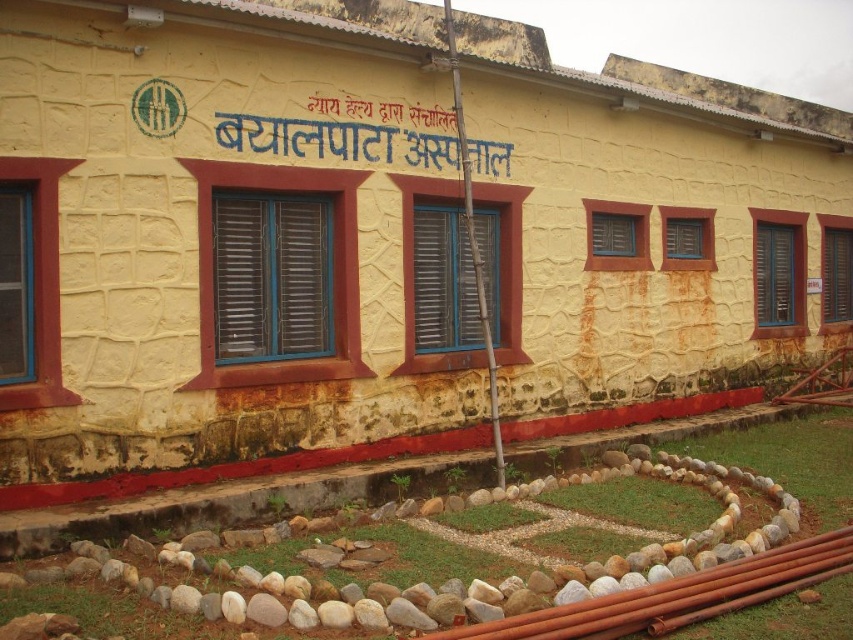
Question: Considering the relative positions of brown metallic pipes at lower right and blue painted signboard at center in the image provided, where is brown metallic pipes at lower right located with respect to blue painted signboard at center?

Choices:
 (A) above
 (B) below

Answer: (B)

Question: Does brown metallic pipes at lower right appear over blue painted signboard at center?

Choices:
 (A) yes
 (B) no

Answer: (B)

Question: In this image, where is brown metallic pipes at lower right located relative to blue painted signboard at center?

Choices:
 (A) left
 (B) right

Answer: (B)

Question: Which point is farther to the camera?

Choices:
 (A) blue painted signboard at center
 (B) brown metallic pipes at lower right

Answer: (A)